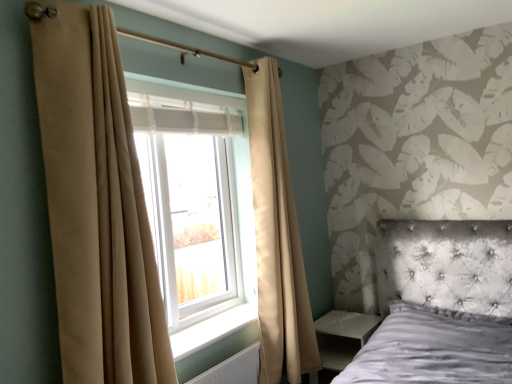
Question: Is beige fabric curtain at left, which is the first curtain in back-to-front order, looking in the opposite direction of white textured radiator at lower center?

Choices:
 (A) yes
 (B) no

Answer: (B)

Question: Is beige fabric curtain at left, which is the first curtain in back-to-front order, smaller than white textured radiator at lower center?

Choices:
 (A) yes
 (B) no

Answer: (B)

Question: Can you confirm if beige fabric curtain at left, which is the first curtain in back-to-front order, is wider than white textured radiator at lower center?

Choices:
 (A) no
 (B) yes

Answer: (B)

Question: Does beige fabric curtain at left, which is the 2th curtain in front-to-back order, have a lesser height compared to white textured radiator at lower center?

Choices:
 (A) no
 (B) yes

Answer: (A)

Question: Does beige fabric curtain at left, which is the 2th curtain in front-to-back order, have a lesser width compared to white textured radiator at lower center?

Choices:
 (A) yes
 (B) no

Answer: (B)

Question: From the image's perspective, is beige fabric curtain at left, which is counted as the second curtain, starting from the back, positioned above or below white smooth window sill at center?

Choices:
 (A) above
 (B) below

Answer: (A)

Question: From a real-world perspective, is beige fabric curtain at left, arranged as the 1th curtain when viewed from the front, above or below white smooth window sill at center?

Choices:
 (A) below
 (B) above

Answer: (B)

Question: Based on their sizes in the image, would you say beige fabric curtain at left, acting as the 2th curtain starting from the right, is bigger or smaller than white smooth window sill at center?

Choices:
 (A) big
 (B) small

Answer: (A)

Question: Is beige fabric curtain at left, the first curtain when ordered from left to right, taller or shorter than white smooth window sill at center?

Choices:
 (A) tall
 (B) short

Answer: (A)

Question: Considering the positions of point (138, 82) and point (60, 327), is point (138, 82) closer or farther from the camera than point (60, 327)?

Choices:
 (A) closer
 (B) farther

Answer: (B)

Question: Is white plastic window at center inside or outside of beige fabric curtain at left, arranged as the 1th curtain when viewed from the front?

Choices:
 (A) outside
 (B) inside

Answer: (A)

Question: Considering their positions, is white plastic window at center located in front of or behind beige fabric curtain at left, which is counted as the second curtain, starting from the back?

Choices:
 (A) front
 (B) behind

Answer: (B)

Question: From the image's perspective, is white plastic window at center located above or below beige fabric curtain at left, the first curtain when ordered from left to right?

Choices:
 (A) below
 (B) above

Answer: (A)

Question: Is beige fabric curtain at left, arranged as the 1th curtain when viewed from the front, wider or thinner than white glossy side table at lower right?

Choices:
 (A) thin
 (B) wide

Answer: (A)

Question: From the image's perspective, is beige fabric curtain at left, the first curtain when ordered from left to right, above or below white glossy side table at lower right?

Choices:
 (A) below
 (B) above

Answer: (B)